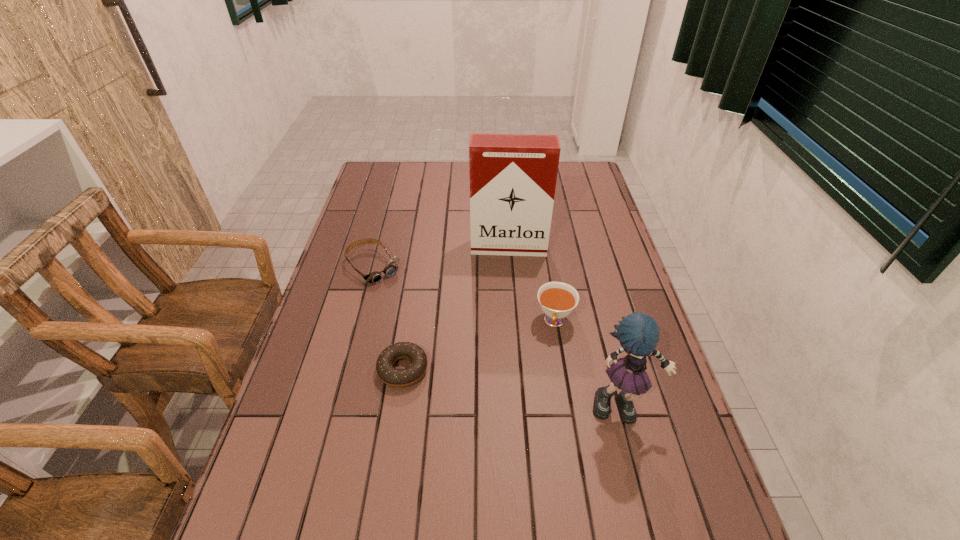
Where is `doughnut`? The width and height of the screenshot is (960, 540). doughnut is located at coordinates click(x=398, y=378).

Where is `rag doll`? rag doll is located at coordinates tap(638, 333).

The height and width of the screenshot is (540, 960). Identify the location of the third shortest object. (557, 300).

Where is `the third nearest object`? the third nearest object is located at coordinates (557, 300).

The width and height of the screenshot is (960, 540). What are the coordinates of `cigarette_case` in the screenshot? It's located at (513, 177).

At what (x,y) coordinates should I click in order to perform the action: click on the fourth tallest object. Please return your answer as a coordinate pair (x, y). Looking at the image, I should click on (375, 277).

This screenshot has height=540, width=960. What are the coordinates of `free region located on the left of the doughnut` in the screenshot? It's located at (350, 369).

Find the location of a particular element. vacant space located on the front-facing side of the second tallest object is located at coordinates (651, 518).

You are a GUI agent. You are given a task and a screenshot of the screen. Output one action in this format:
    pyautogui.click(x=<x>, y=<y>)
    Task: Click on the vacant area situated on the side of the teacup with the handle
    
    Given the screenshot: What is the action you would take?
    pyautogui.click(x=530, y=449)

At what (x,y) coordinates should I click in order to perform the action: click on vacant space located 0.240m on the side of the teacup with the handle. Please return your answer as a coordinate pair (x, y). Image resolution: width=960 pixels, height=540 pixels. Looking at the image, I should click on (537, 417).